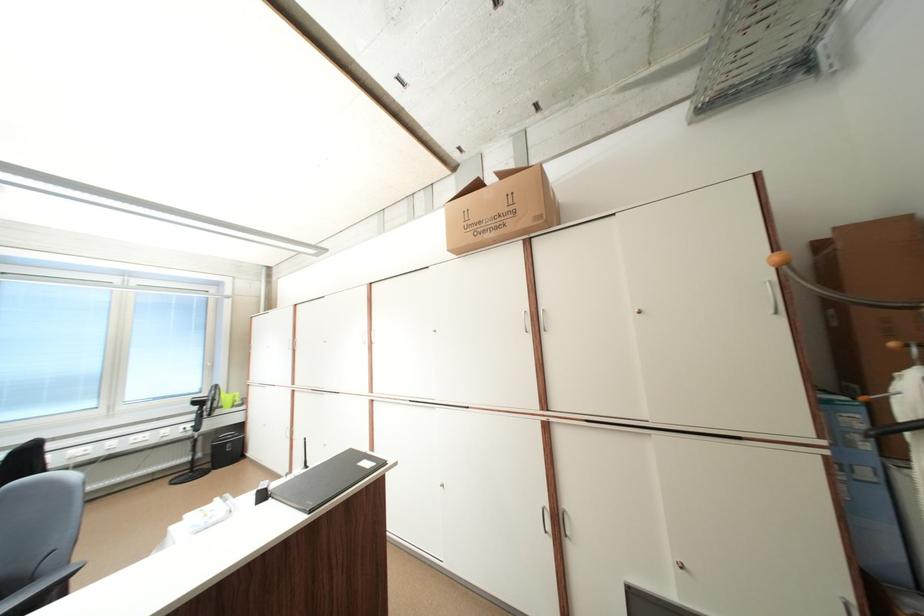
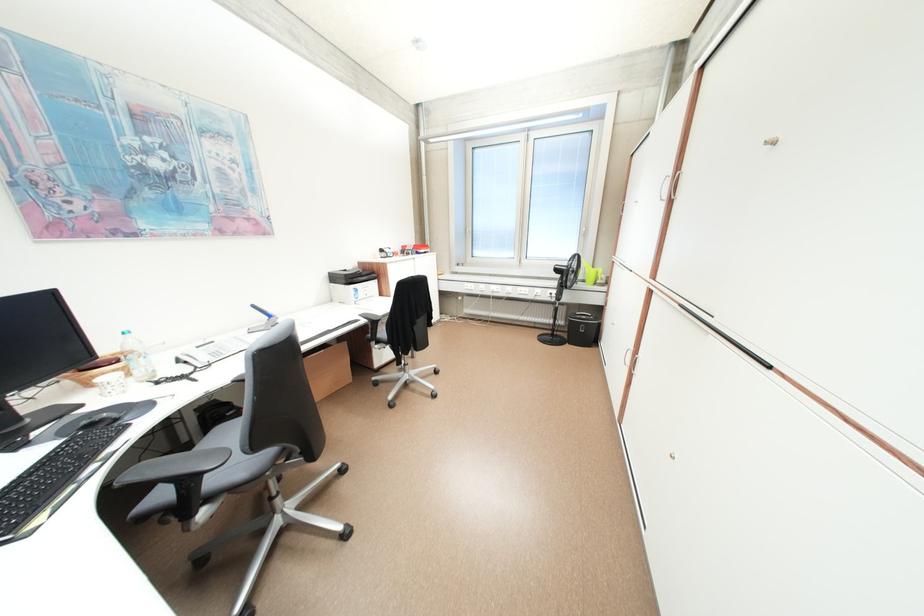
In the second image, find the point that corresponds to point (201, 474) in the first image.

(561, 338)